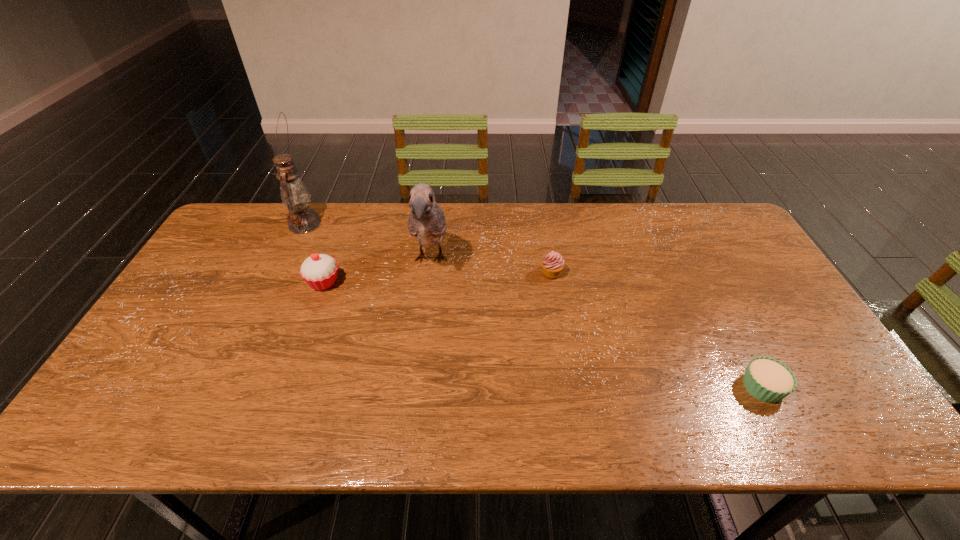
Identify the location of vacant region at the far edge. Image resolution: width=960 pixels, height=540 pixels. (367, 232).

Find the location of a particular element. vacant position at the near edge of the desktop is located at coordinates (365, 421).

Locate an element on the screen. The height and width of the screenshot is (540, 960). free space at the left edge is located at coordinates click(x=166, y=379).

In order to click on vacant area at the right edge in this screenshot , I will do `click(716, 255)`.

At what (x,y) coordinates should I click in order to perform the action: click on free space at the far right corner. Please return your answer as a coordinate pair (x, y). This screenshot has width=960, height=540. Looking at the image, I should click on (732, 240).

The width and height of the screenshot is (960, 540). Identify the location of free space between the second cupcake from left to right and the leftmost cupcake. (438, 278).

Locate an element on the screen. free spot between the fourth shortest object and the oil lamp is located at coordinates (368, 242).

Image resolution: width=960 pixels, height=540 pixels. Identify the location of vacant space that's between the leftmost object and the nearest object. (534, 306).

Locate an element on the screen. This screenshot has height=540, width=960. free space between the shortest object and the leftmost object is located at coordinates (534, 306).

Where is `unoccupied position between the oil lamp and the third object from right to left`? unoccupied position between the oil lamp and the third object from right to left is located at coordinates (368, 242).